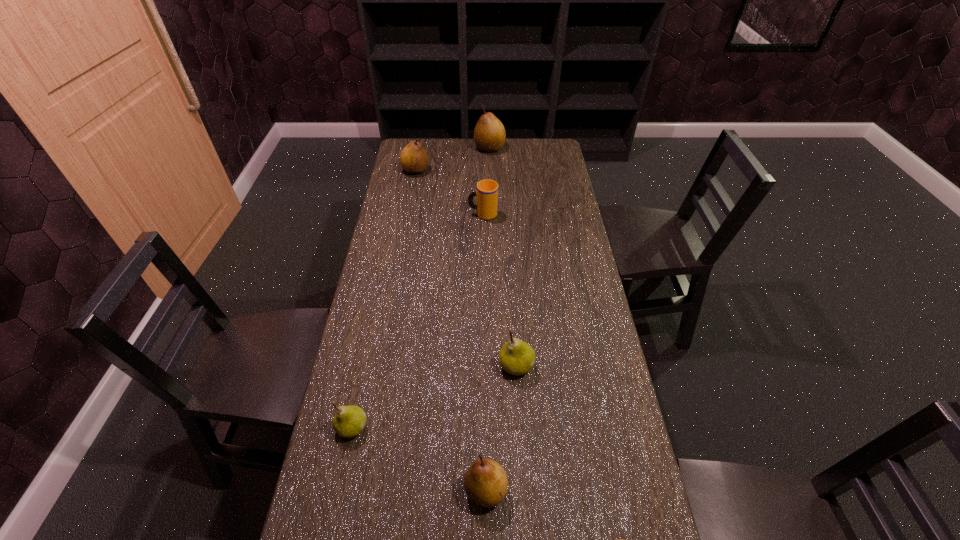
At what (x,y) coordinates should I click in order to perform the action: click on the nearer green pear. Please return your answer as a coordinate pair (x, y). The image size is (960, 540). Looking at the image, I should click on (349, 421).

Identify the location of the left green pear. (349, 421).

At what (x,y) coordinates should I click in order to perform the action: click on free region located 0.210m on the front of the farthest pear. Please return your answer as a coordinate pair (x, y). This screenshot has height=540, width=960. Looking at the image, I should click on (491, 182).

This screenshot has height=540, width=960. Find the location of `vacant space situated 0.200m on the right of the leftmost brown pear`. vacant space situated 0.200m on the right of the leftmost brown pear is located at coordinates (475, 171).

Find the location of a particular element. vacant space situated 0.090m on the back of the farther green pear is located at coordinates (514, 327).

Locate an element on the screen. This screenshot has height=540, width=960. vacant space located 0.090m on the side of the third farthest object with the handle is located at coordinates (445, 214).

You are a GUI agent. You are given a task and a screenshot of the screen. Output one action in this format:
    pyautogui.click(x=<x>, y=<y>)
    Task: Click on the free space located 0.160m on the side of the third farthest object with the handle
    
    Given the screenshot: What is the action you would take?
    pyautogui.click(x=427, y=214)

Find the location of a particular element. The height and width of the screenshot is (540, 960). free location located on the side of the third farthest object with the handle is located at coordinates (407, 214).

Locate an element on the screen. This screenshot has height=540, width=960. vacant space located 0.180m on the back of the second nearest object is located at coordinates (485, 400).

Identify the location of free space located on the front of the left green pear. (336, 502).